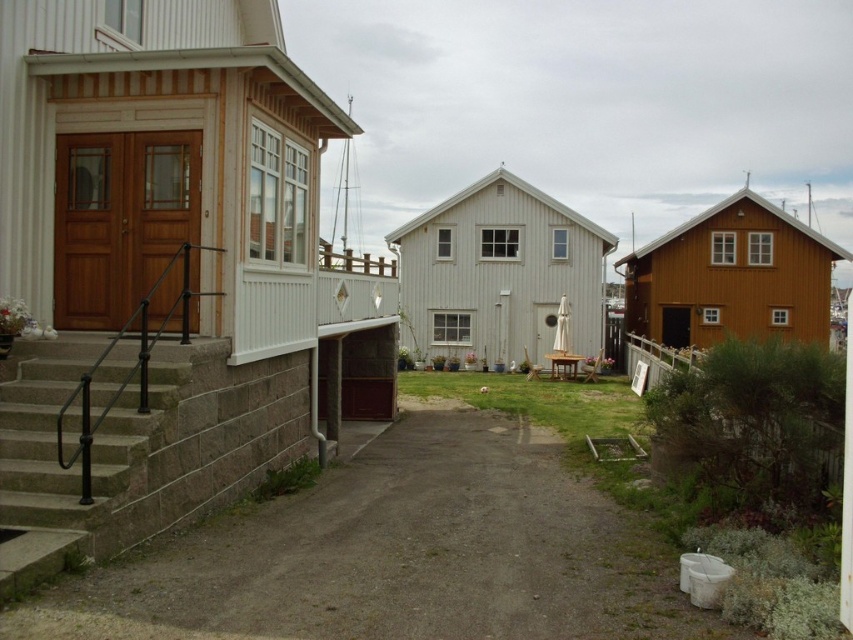
Between dirt/gravel driveway at center and brown stone stairs at left, which one has more height?

Standing taller between the two is brown stone stairs at left.

Can you confirm if dirt/gravel driveway at center is positioned above brown stone stairs at left?

No, dirt/gravel driveway at center is not above brown stone stairs at left.

Is point (38, 616) more distant than point (161, 520)?

No, (38, 616) is closer to viewer.

Locate an element on the screen. The image size is (853, 640). dirt/gravel driveway at center is located at coordinates (398, 554).